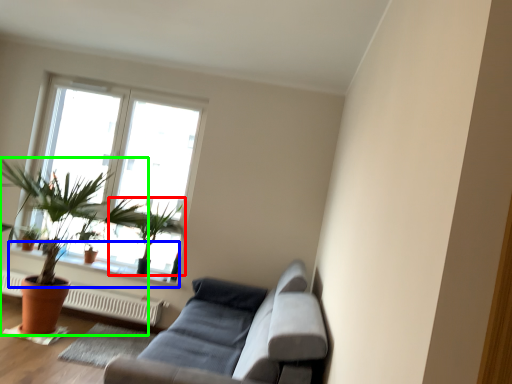
Question: Estimate the real-world distances between objects in this image. Which object is farther from houseplant (highlighted by a red box), window sill (highlighted by a blue box) or houseplant (highlighted by a green box)?

Choices:
 (A) window sill
 (B) houseplant

Answer: (A)